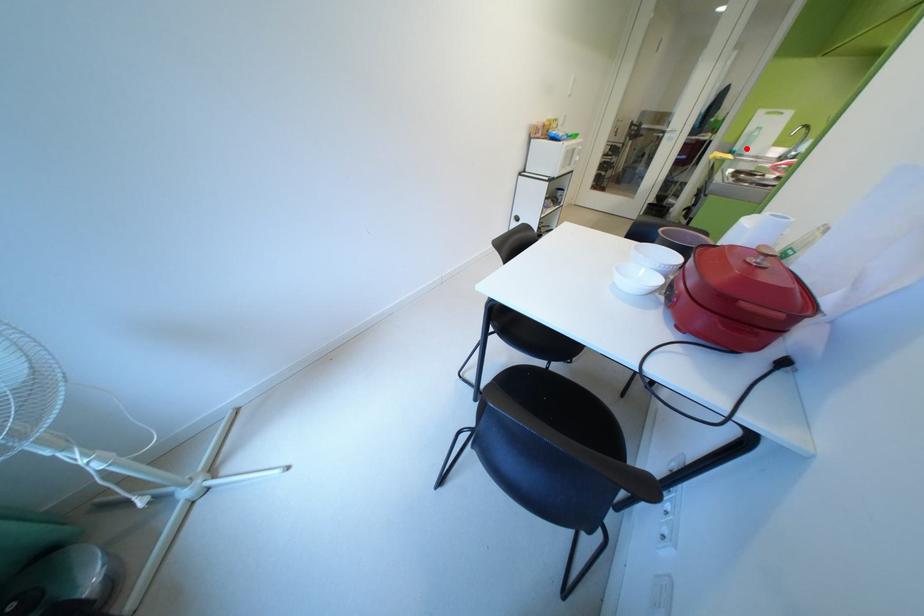
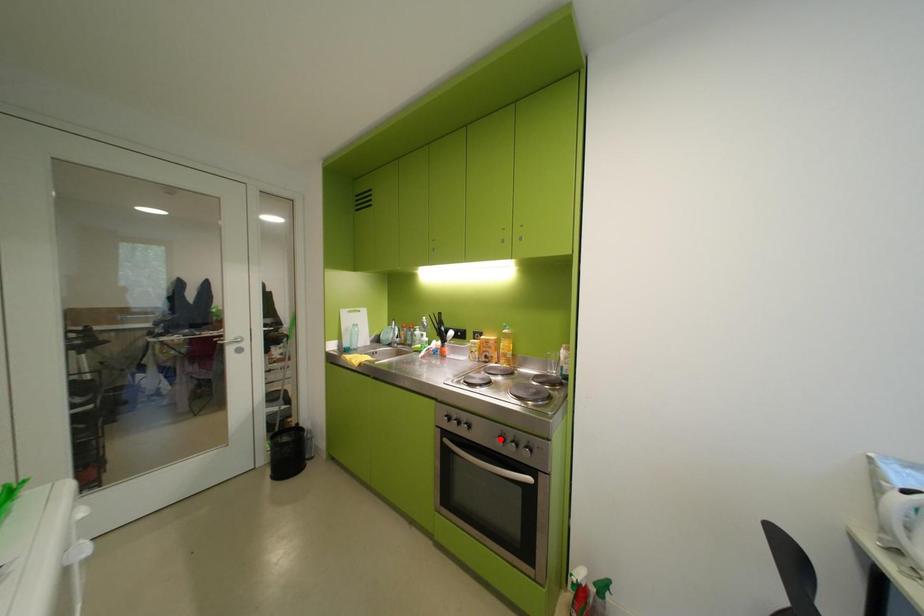
I am providing you with two images of the same scene from different viewpoints. A red point is marked on the first image and another point is marked on the second image. Is the marked point in image1 the same physical position as the marked point in image2?

No